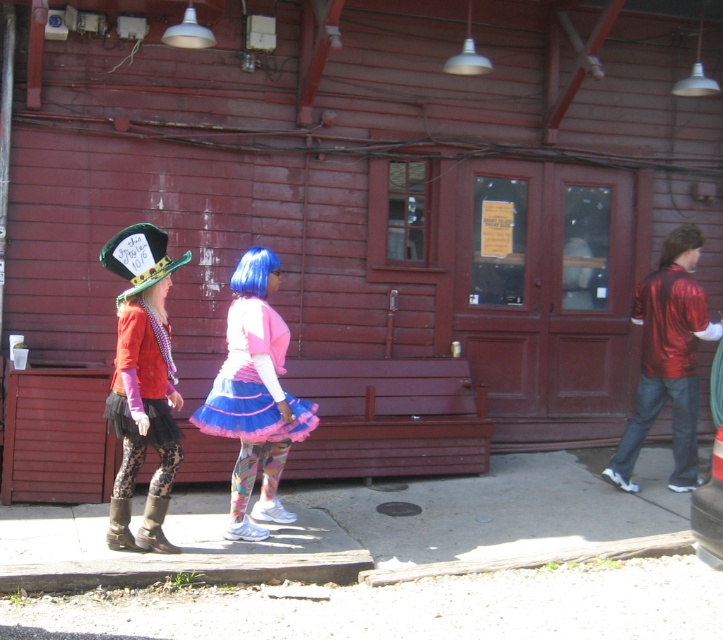
You are standing in front of the red wooden building and notice two items in the foreground. Which one is positioned more to the left between the matte green hat at left and the leather boot at lower left?

The matte green hat at left is positioned more to the left than the leather boot at lower left according to the description.

You are a photographer trying to capture a photo of the two people walking away from the camera. The matte black tutu at left and the leather boot at lower left are in the frame. If your camera has a minimum focus distance of 25 inches, will you be able to focus on both objects clearly?

The matte black tutu at left is 26.11 inches from the leather boot at lower left. Since the minimum focus distance is 25 inches, the distance between them is slightly beyond the camera limit, so you may need to step back to ensure both are in focus.

You are standing in front of the red wooden building and notice two pairs of footwear near the base of the door. Which footwear is closer to the door, the leather boot at lower left or the leather boots at lower left?

The leather boot at lower left is positioned under leather boots at lower left, meaning it is closer to the door.